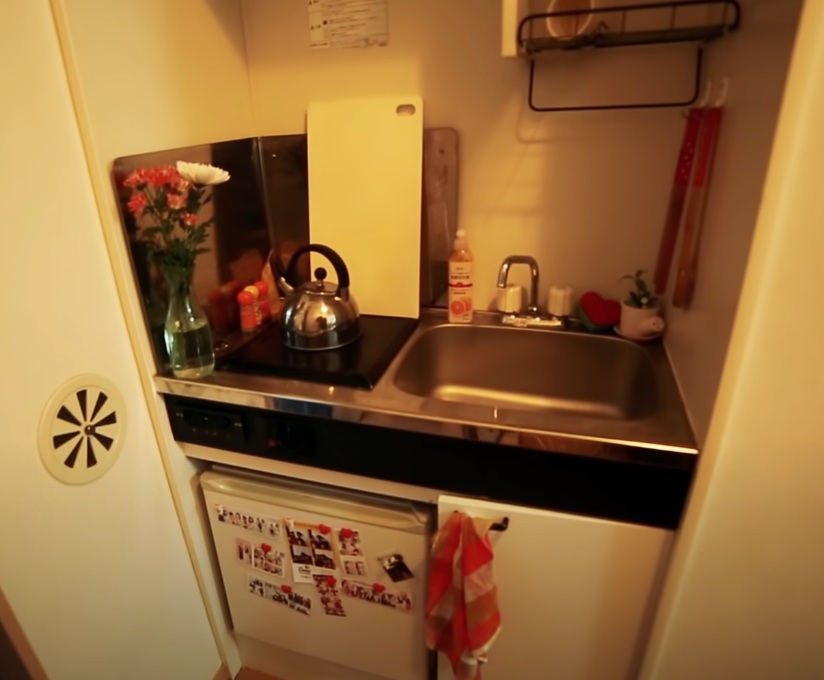
Where is `cabinet`? cabinet is located at coordinates (601, 570).